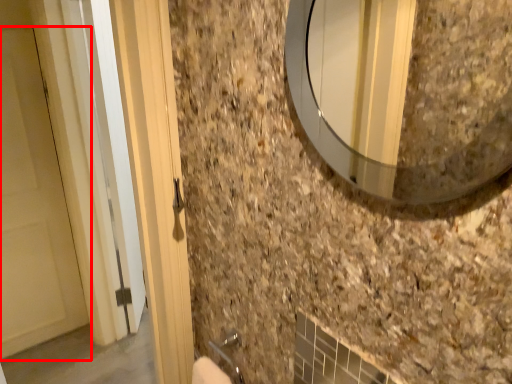
Question: From the image's perspective, where is door (annotated by the red box) located relative to mirror?

Choices:
 (A) below
 (B) above

Answer: (A)